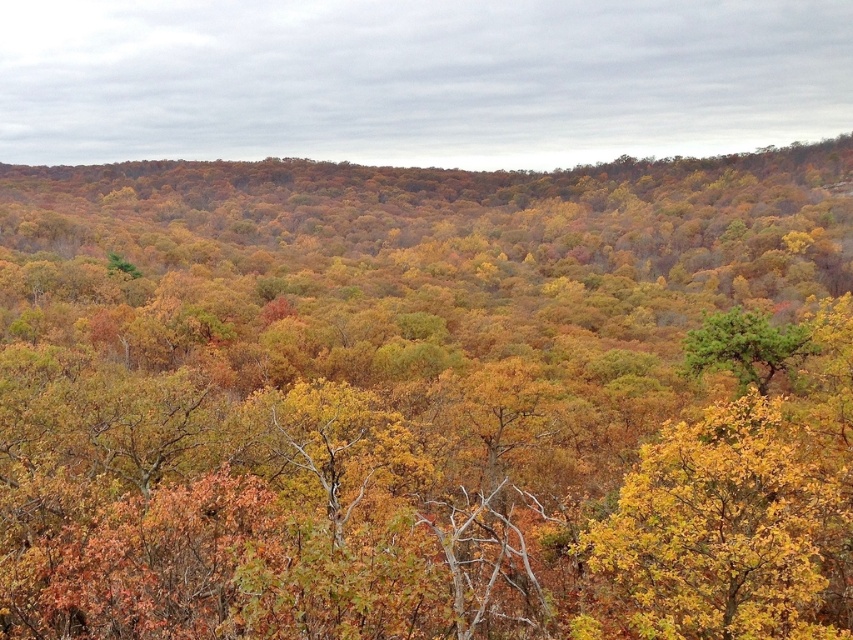
Can you confirm if yellow-green foliage at center-right is positioned to the left of green textured tree at center?

Yes, yellow-green foliage at center-right is to the left of green textured tree at center.

The width and height of the screenshot is (853, 640). What are the coordinates of `yellow-green foliage at center-right` in the screenshot? It's located at (730, 531).

Describe the element at coordinates (730, 531) in the screenshot. The width and height of the screenshot is (853, 640). I see `yellow-green foliage at center-right` at that location.

You are a GUI agent. You are given a task and a screenshot of the screen. Output one action in this format:
    pyautogui.click(x=<x>, y=<y>)
    Task: Click on the yellow-green foliage at center-right
    This screenshot has width=853, height=640.
    Given the screenshot: What is the action you would take?
    pyautogui.click(x=730, y=531)